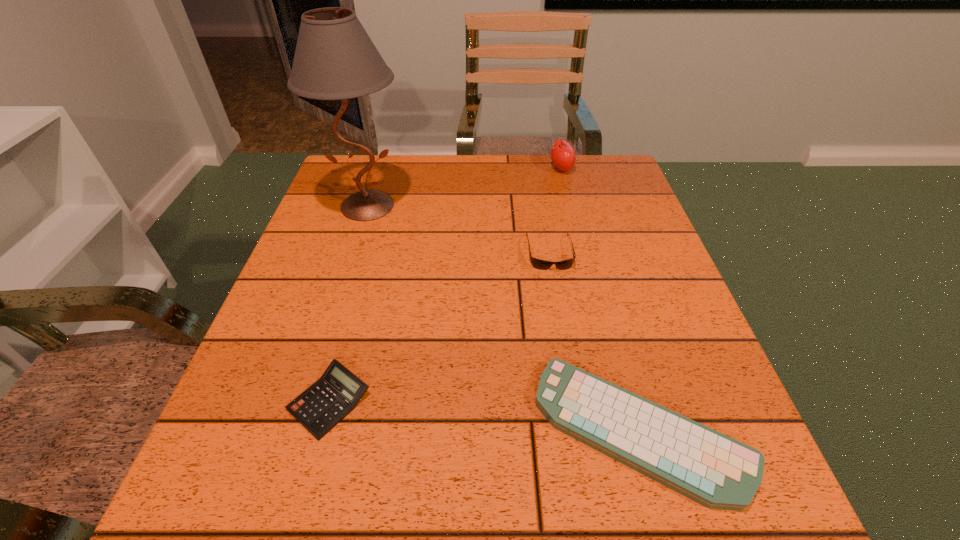
The width and height of the screenshot is (960, 540). I want to click on blank area in the image that satisfies the following two spatial constraints: 1. on the front-facing side of the calculator; 2. on the left side of the table lamp, so click(306, 401).

This screenshot has height=540, width=960. Identify the location of free spot that satisfies the following two spatial constraints: 1. on the front-facing side of the computer keyboard; 2. on the right side of the fourth nearest object. (298, 429).